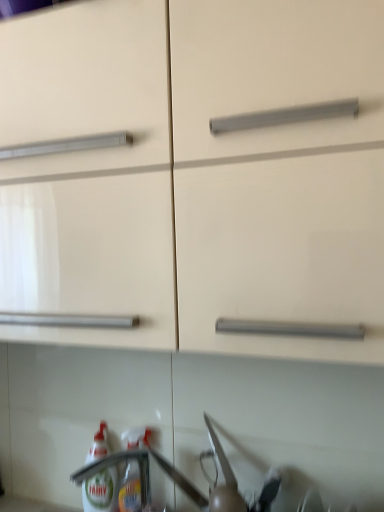
Question: Is translucent plastic bottle at lower left, arranged as the second bottle when viewed from the left, smaller than matte white cabinet at center?

Choices:
 (A) yes
 (B) no

Answer: (A)

Question: Does translucent plastic bottle at lower left, arranged as the second bottle when viewed from the left, come behind matte white cabinet at center?

Choices:
 (A) no
 (B) yes

Answer: (B)

Question: Does translucent plastic bottle at lower left, arranged as the second bottle when viewed from the left, come in front of matte white cabinet at center?

Choices:
 (A) yes
 (B) no

Answer: (B)

Question: From the image's perspective, is translucent plastic bottle at lower left, positioned as the first bottle in right-to-left order, located above matte white cabinet at center?

Choices:
 (A) no
 (B) yes

Answer: (A)

Question: From a real-world perspective, does translucent plastic bottle at lower left, positioned as the first bottle in right-to-left order, sit lower than matte white cabinet at center?

Choices:
 (A) no
 (B) yes

Answer: (B)

Question: Can we say translucent plastic bottle at lower left, arranged as the second bottle when viewed from the left, lies outside matte white cabinet at center?

Choices:
 (A) no
 (B) yes

Answer: (B)

Question: From the image's perspective, is translucent plastic bottle at lower left, positioned as the first bottle in right-to-left order, on top of white glossy bottle at lower left, acting as the second bottle starting from the right?

Choices:
 (A) yes
 (B) no

Answer: (A)

Question: Is there a large distance between translucent plastic bottle at lower left, positioned as the first bottle in right-to-left order, and white glossy bottle at lower left, the first bottle positioned from the left?

Choices:
 (A) yes
 (B) no

Answer: (B)

Question: Does translucent plastic bottle at lower left, positioned as the first bottle in right-to-left order, touch white glossy bottle at lower left, acting as the second bottle starting from the right?

Choices:
 (A) no
 (B) yes

Answer: (B)

Question: Considering the relative positions of translucent plastic bottle at lower left, positioned as the first bottle in right-to-left order, and white glossy bottle at lower left, acting as the second bottle starting from the right, in the image provided, is translucent plastic bottle at lower left, positioned as the first bottle in right-to-left order, to the left of white glossy bottle at lower left, acting as the second bottle starting from the right, from the viewer's perspective?

Choices:
 (A) yes
 (B) no

Answer: (B)

Question: Is the position of translucent plastic bottle at lower left, positioned as the first bottle in right-to-left order, more distant than that of white glossy bottle at lower left, acting as the second bottle starting from the right?

Choices:
 (A) yes
 (B) no

Answer: (B)

Question: Is translucent plastic bottle at lower left, positioned as the first bottle in right-to-left order, oriented away from white glossy bottle at lower left, the first bottle positioned from the left?

Choices:
 (A) yes
 (B) no

Answer: (B)

Question: From the image's perspective, is matte white cabinet at center located above translucent plastic bottle at lower left, arranged as the second bottle when viewed from the left?

Choices:
 (A) no
 (B) yes

Answer: (B)